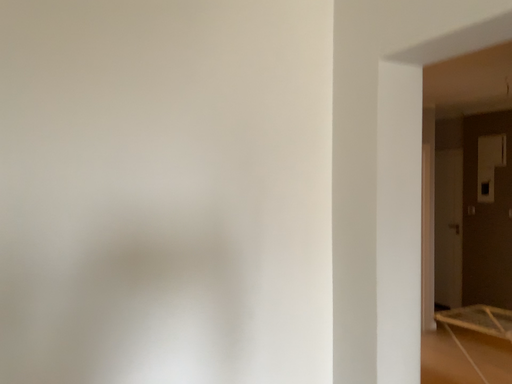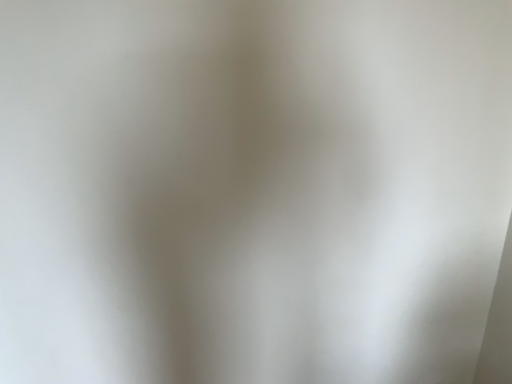
Question: Which way did the camera rotate in the video?

Choices:
 (A) rotated downward
 (B) rotated upward

Answer: (A)